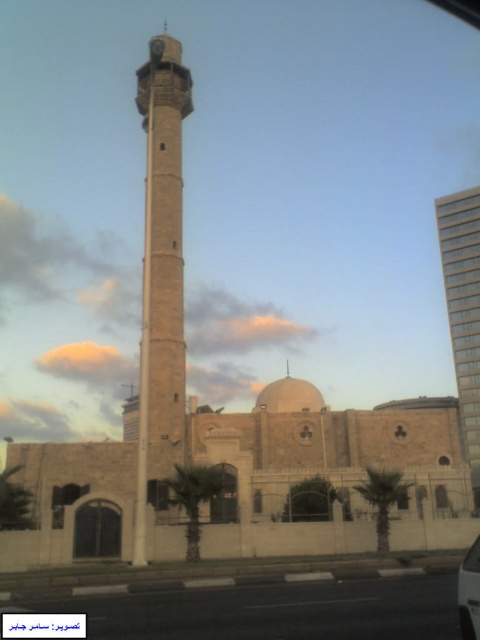
Is green leafy palm tree at lower right below metallic silver car at center?

Yes.

Does green leafy palm tree at lower right have a smaller size compared to metallic silver car at center?

Actually, green leafy palm tree at lower right might be larger than metallic silver car at center.

Does point (391, 484) lie in front of point (468, 605)?

No, it is not.

This screenshot has height=640, width=480. Identify the location of green leafy palm tree at lower right. (383, 499).

Does green leafy palm tree at lower center have a lesser width compared to green leafy palm tree at lower right?

Yes.

Does green leafy palm tree at lower center have a greater height compared to green leafy palm tree at lower right?

Incorrect, green leafy palm tree at lower center's height is not larger of green leafy palm tree at lower right's.

Locate an element on the screen. Image resolution: width=480 pixels, height=640 pixels. green leafy palm tree at lower center is located at coordinates (192, 497).

Find the location of a particular element. The width and height of the screenshot is (480, 640). green leafy palm tree at lower center is located at coordinates (192, 497).

Does glassy reflective skyscraper at right appear over metallic silver car at center?

Yes.

Can you confirm if glassy reflective skyscraper at right is wider than metallic silver car at center?

Yes, glassy reflective skyscraper at right is wider than metallic silver car at center.

Between point (451, 268) and point (477, 600), which one is positioned in front?

Positioned in front is point (477, 600).

Identify the location of glassy reflective skyscraper at right. The width and height of the screenshot is (480, 640). (463, 301).